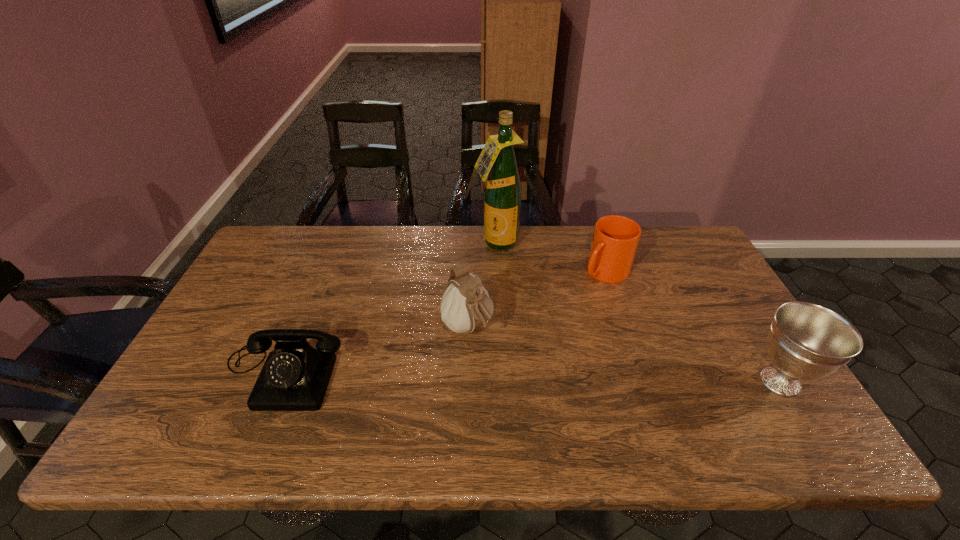
In order to click on free space on the desktop that is between the telephone and the chalice and is positioned on the handle side of the fourth nearest object in this screenshot , I will do `click(496, 375)`.

I want to click on vacant space on the desktop that is between the shortest object and the chalice and is positioned on the front-facing side of the pouch, so click(x=519, y=375).

This screenshot has width=960, height=540. I want to click on free spot on the desktop that is between the leftmost object and the chalice and is positioned on the front-facing side of the tallest object, so click(x=504, y=375).